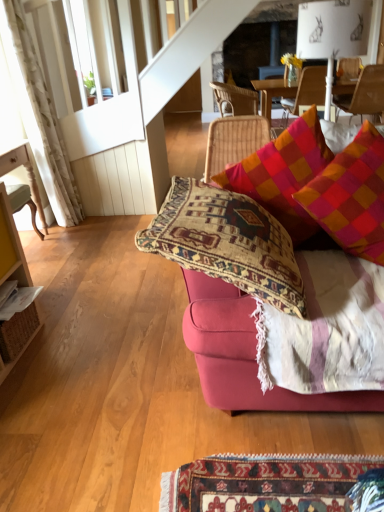
The width and height of the screenshot is (384, 512). Identify the location of unoccupied region to the right of wooden chair at left, which ranks as the fourth chair in back-to-front order. (74, 238).